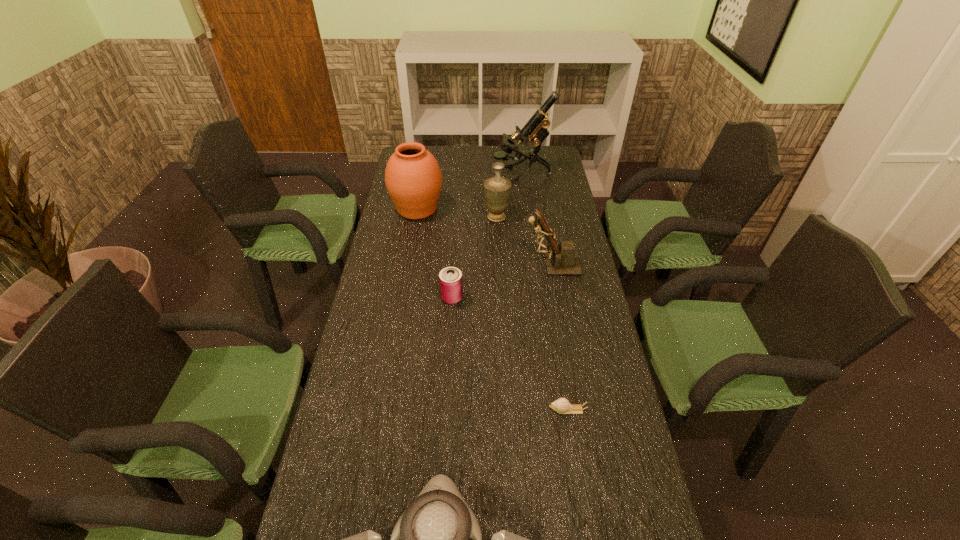
Identify the location of vacant region located 0.220m through the eyepiece of the microscope. This screenshot has width=960, height=540. (444, 174).

This screenshot has width=960, height=540. Find the location of `free space located 0.400m on the front of the left urn`. free space located 0.400m on the front of the left urn is located at coordinates (401, 301).

This screenshot has width=960, height=540. I want to click on free space located 0.250m on the front-facing side of the fourth farthest object, so click(x=453, y=264).

You are a GUI agent. You are given a task and a screenshot of the screen. Output one action in this format:
    pyautogui.click(x=<x>, y=<y>)
    Task: Click on the free spot located on the front-facing side of the fourth farthest object
    The image size is (960, 540).
    Given the screenshot: What is the action you would take?
    coord(450,264)

The width and height of the screenshot is (960, 540). I want to click on vacant area situated 0.150m on the front-facing side of the fourth farthest object, so click(x=481, y=264).

You are a GUI agent. You are given a task and a screenshot of the screen. Output one action in this format:
    pyautogui.click(x=<x>, y=<y>)
    Task: Click on the free space located on the right of the right urn
    This screenshot has height=540, width=960.
    Given the screenshot: What is the action you would take?
    pyautogui.click(x=538, y=217)

Identify the location of vacant space located 0.050m on the right of the can. tap(478, 298).

Locate an element on the screen. The image size is (960, 540). vacant position located 0.140m on the shell of the shortest object is located at coordinates (495, 410).

Where is `free space located on the shell of the shortest object`? The height and width of the screenshot is (540, 960). free space located on the shell of the shortest object is located at coordinates (471, 410).

In order to click on free space located on the shell of the shortest object in this screenshot , I will do `click(429, 410)`.